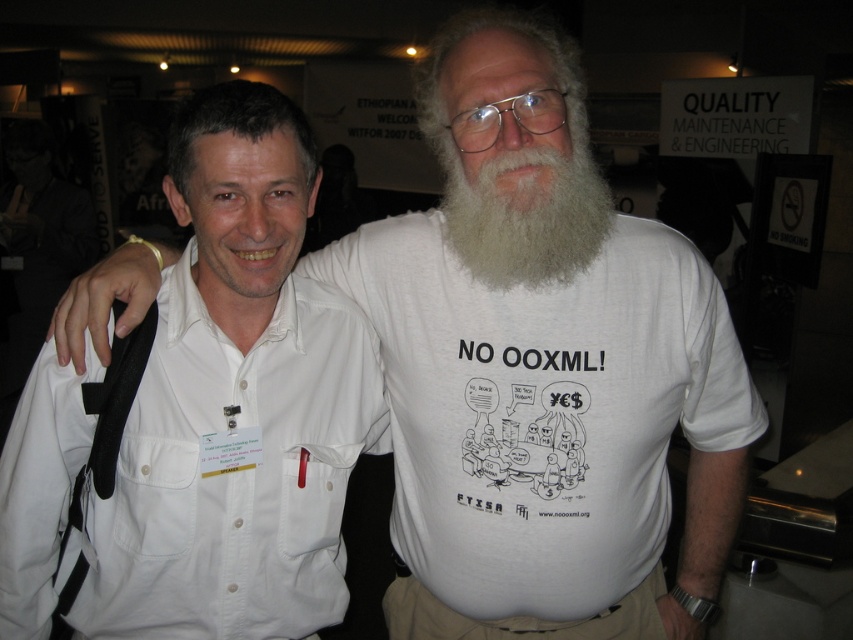
Does white cotton t-shirt at center lie behind white fuzzy beard at center?

Yes, white cotton t-shirt at center is further from the viewer.

Does point (726, 416) come farther from viewer compared to point (514, 275)?

That is True.

The width and height of the screenshot is (853, 640). Find the location of `white cotton t-shirt at center`. white cotton t-shirt at center is located at coordinates (541, 410).

Who is lower down, white cotton t-shirt at center or white cotton shirt at left?

white cotton shirt at left

The height and width of the screenshot is (640, 853). Describe the element at coordinates (541, 410) in the screenshot. I see `white cotton t-shirt at center` at that location.

Locate an element on the screen. white cotton t-shirt at center is located at coordinates (541, 410).

Between white fuzzy beard at center and khaki pants at lower center, which one has more height?

white fuzzy beard at center

Does white fuzzy beard at center have a greater height compared to khaki pants at lower center?

Yes.

Which is behind, point (569, 225) or point (535, 628)?

The point (535, 628) is behind.

I want to click on white fuzzy beard at center, so click(526, 214).